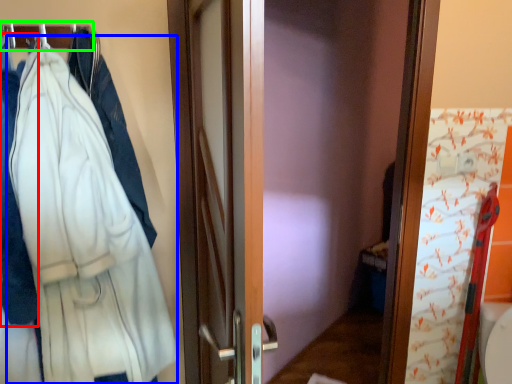
Question: Estimate the real-world distances between objects in this image. Which object is farther from garment (highlighted by a red box), bathrobe (highlighted by a blue box) or hanger (highlighted by a green box)?

Choices:
 (A) bathrobe
 (B) hanger

Answer: (B)